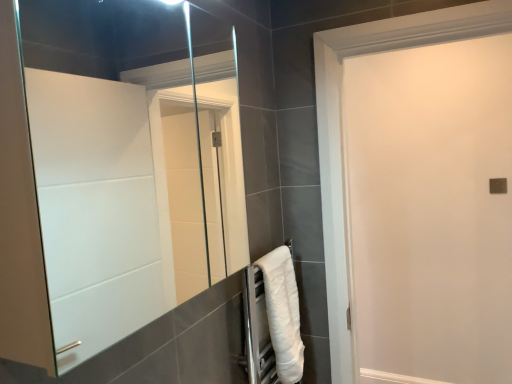
Question: Is clear glass mirror at center positioned beyond the bounds of white fluffy towel at lower right?

Choices:
 (A) no
 (B) yes

Answer: (B)

Question: Is clear glass mirror at center closer to the viewer compared to white fluffy towel at lower right?

Choices:
 (A) no
 (B) yes

Answer: (B)

Question: Considering the relative sizes of clear glass mirror at center and white fluffy towel at lower right in the image provided, is clear glass mirror at center taller than white fluffy towel at lower right?

Choices:
 (A) yes
 (B) no

Answer: (A)

Question: Is clear glass mirror at center next to white fluffy towel at lower right and touching it?

Choices:
 (A) yes
 (B) no

Answer: (B)

Question: Does clear glass mirror at center have a lesser width compared to white fluffy towel at lower right?

Choices:
 (A) no
 (B) yes

Answer: (A)

Question: Is clear glass mirror at center at the left side of white fluffy towel at lower right?

Choices:
 (A) yes
 (B) no

Answer: (A)

Question: Is clear glass mirror at center oriented towards white matte door at center?

Choices:
 (A) no
 (B) yes

Answer: (A)

Question: Does clear glass mirror at center touch white matte door at center?

Choices:
 (A) no
 (B) yes

Answer: (A)

Question: Is clear glass mirror at center far away from white matte door at center?

Choices:
 (A) no
 (B) yes

Answer: (B)

Question: Is clear glass mirror at center to the left of white matte door at center from the viewer's perspective?

Choices:
 (A) yes
 (B) no

Answer: (A)

Question: Is clear glass mirror at center shorter than white matte door at center?

Choices:
 (A) no
 (B) yes

Answer: (B)

Question: Is clear glass mirror at center in front of white matte door at center?

Choices:
 (A) yes
 (B) no

Answer: (A)

Question: From the image's perspective, is white fluffy towel at lower right below white matte door at center?

Choices:
 (A) yes
 (B) no

Answer: (A)